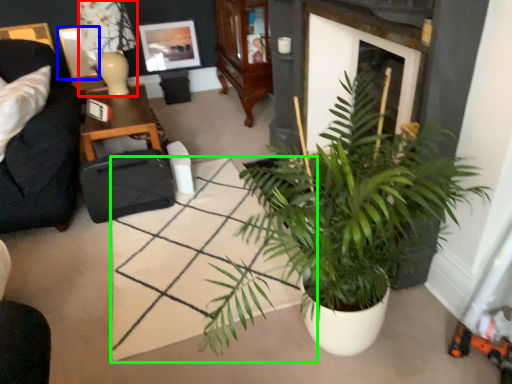
Question: Estimate the real-world distances between objects in this image. Which object is farther from lamp (highlighted by a red box), picture frame (highlighted by a blue box) or square (highlighted by a green box)?

Choices:
 (A) picture frame
 (B) square

Answer: (B)